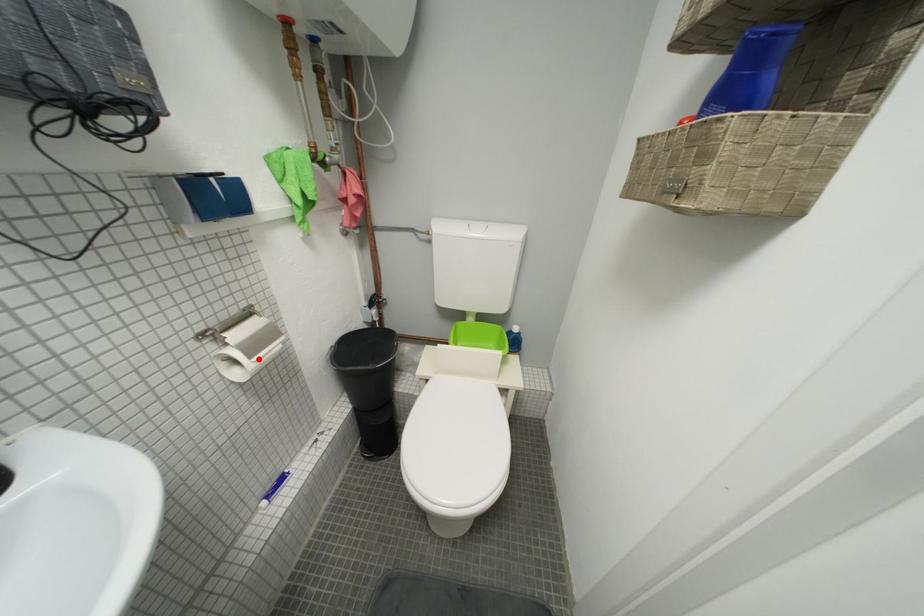
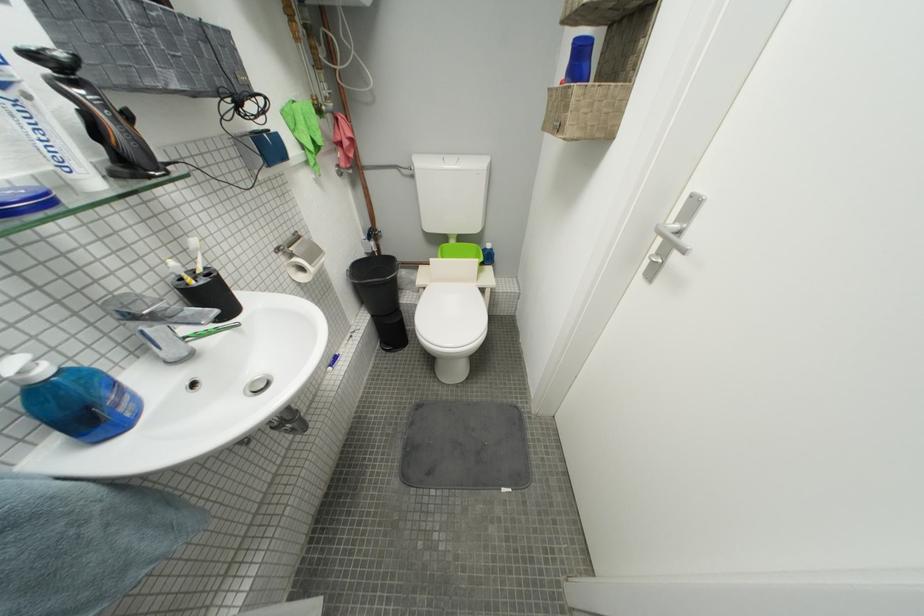
Question: I am providing you with two images of the same scene from different viewpoints. A red point is shown in image1. For the corresponding object point in image2, is it positioned nearer or farther from the camera?

Choices:
 (A) Nearer
 (B) Farther

Answer: (A)